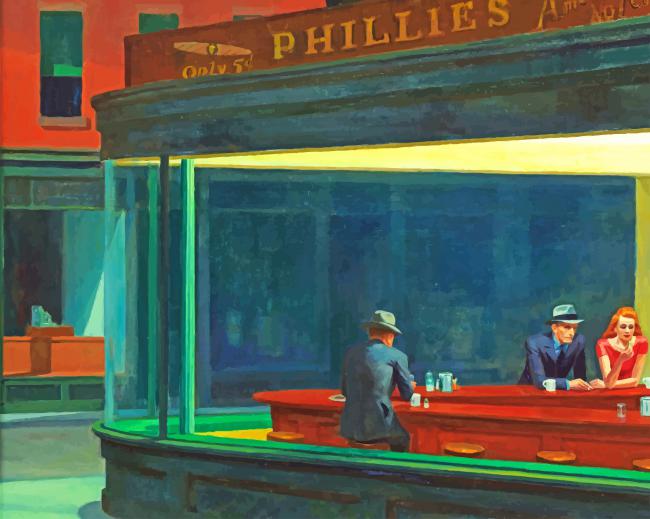
Where is `cash register`? The height and width of the screenshot is (519, 650). cash register is located at coordinates (42, 319).